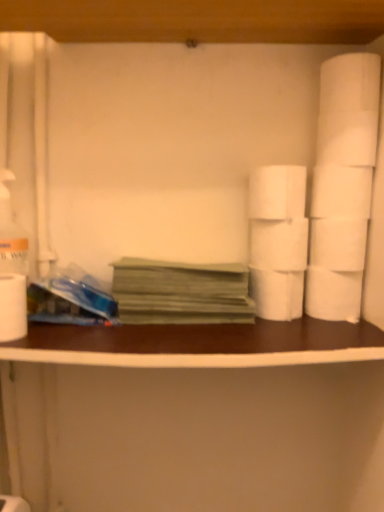
Question: Is white matte toilet paper at right, the 4th toilet paper positioned from the right, smaller than white matte toilet paper at right, the 4th toilet paper in the left-to-right sequence?

Choices:
 (A) no
 (B) yes

Answer: (B)

Question: From the image's perspective, would you say white matte toilet paper at right, the fifth toilet paper positioned from the left, is positioned over white matte toilet paper at right, arranged as the fifth toilet paper when viewed from the right?

Choices:
 (A) yes
 (B) no

Answer: (B)

Question: Is white matte toilet paper at right, arranged as the fifth toilet paper when viewed from the right, at the back of white matte toilet paper at right, the fifth toilet paper positioned from the left?

Choices:
 (A) no
 (B) yes

Answer: (A)

Question: From a real-world perspective, is white matte toilet paper at right, the fifth toilet paper positioned from the left, positioned over white matte toilet paper at right, arranged as the fifth toilet paper when viewed from the right, based on gravity?

Choices:
 (A) no
 (B) yes

Answer: (A)

Question: Can you confirm if white matte toilet paper at right, the 4th toilet paper positioned from the right, is taller than white matte toilet paper at right, arranged as the fifth toilet paper when viewed from the right?

Choices:
 (A) yes
 (B) no

Answer: (A)

Question: From the image's perspective, is white matte counter top at center above or below green paper at center?

Choices:
 (A) above
 (B) below

Answer: (B)

Question: Choose the correct answer: Is white matte counter top at center inside green paper at center or outside it?

Choices:
 (A) inside
 (B) outside

Answer: (B)

Question: In terms of width, does white matte counter top at center look wider or thinner when compared to green paper at center?

Choices:
 (A) wide
 (B) thin

Answer: (A)

Question: From a real-world perspective, is white matte counter top at center above or below green paper at center?

Choices:
 (A) below
 (B) above

Answer: (A)

Question: Considering the positions of white matte toilet paper at right, the 4th toilet paper positioned from the right, and white matte toilet paper at right, arranged as the fifth toilet paper when viewed from the right, in the image, is white matte toilet paper at right, the 4th toilet paper positioned from the right, bigger or smaller than white matte toilet paper at right, arranged as the fifth toilet paper when viewed from the right,?

Choices:
 (A) big
 (B) small

Answer: (B)

Question: Is point (326, 293) closer or farther from the camera than point (266, 253)?

Choices:
 (A) closer
 (B) farther

Answer: (B)

Question: From a real-world perspective, is white matte toilet paper at right, the 4th toilet paper positioned from the right, physically located above or below white matte toilet paper at right, the 4th toilet paper in the left-to-right sequence?

Choices:
 (A) above
 (B) below

Answer: (B)

Question: Looking at their shapes, would you say white matte toilet paper at right, the fifth toilet paper positioned from the left, is wider or thinner than white matte toilet paper at right, the 4th toilet paper in the left-to-right sequence?

Choices:
 (A) wide
 (B) thin

Answer: (B)

Question: Is green paper at center bigger or smaller than white matte toilet paper at right, placed as the seventh toilet paper when sorted from right to left?

Choices:
 (A) small
 (B) big

Answer: (B)

Question: Considering the relative positions of green paper at center and white matte toilet paper at right, placed as the seventh toilet paper when sorted from right to left, in the image provided, is green paper at center to the left or to the right of white matte toilet paper at right, placed as the seventh toilet paper when sorted from right to left,?

Choices:
 (A) right
 (B) left

Answer: (B)